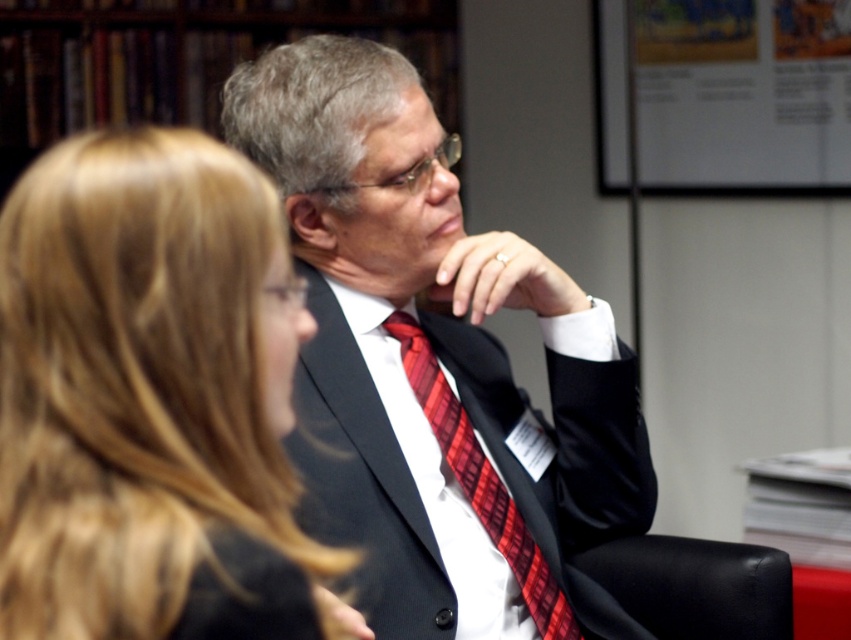
You are an interior designer assessing the layout of this room. You notice the blonde hair at upper left and the black leather chair at lower right. Which object occupies more visual space in the composition?

The blonde hair at upper left occupies more visual space than the black leather chair at lower right, as it is described as bigger in the composition.

You are standing at the entrance of the room and see two points marked in the image. Which point is closer to you, point (164,620) or point (483,524)?

Point (164,620) is closer to you because it is in front of point (483,524).